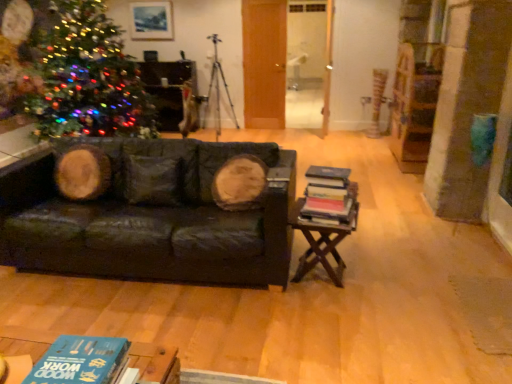
What are the coordinates of `free location to the right of dark green leather couch at center` in the screenshot? It's located at (384, 289).